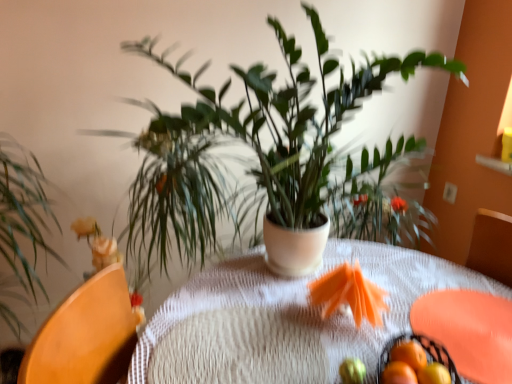
Question: Considering the positions of point (422, 347) and point (60, 231), is point (422, 347) closer or farther from the camera than point (60, 231)?

Choices:
 (A) farther
 (B) closer

Answer: (B)

Question: Based on their sizes in the image, would you say black wire basket at lower right is bigger or smaller than green leafy plant at left, acting as the first houseplant starting from the left?

Choices:
 (A) big
 (B) small

Answer: (B)

Question: Which object is the farthest from the green matte plant at center, which is counted as the second houseplant, starting from the left?

Choices:
 (A) orange matte tangerine at lower right, arranged as the third tangerine when viewed from the front
 (B) orange matte tangerine at lower right, the second tangerine in the front-to-back sequence
 (C) smooth yellow fruit at center
 (D) orange matte tangerine at lower right, the 1th tangerine viewed from the front
 (E) black wire basket at lower right

Answer: (B)

Question: Which of these objects is positioned closest to the smooth yellow fruit at center?

Choices:
 (A) green matte plant at center, which is the first houseplant in right-to-left order
 (B) orange matte tangerine at lower right, which is the 2th tangerine from back to front
 (C) orange matte tangerine at lower right, the third tangerine positioned from the back
 (D) green leafy plant at left, acting as the first houseplant starting from the left
 (E) black wire basket at lower right

Answer: (C)